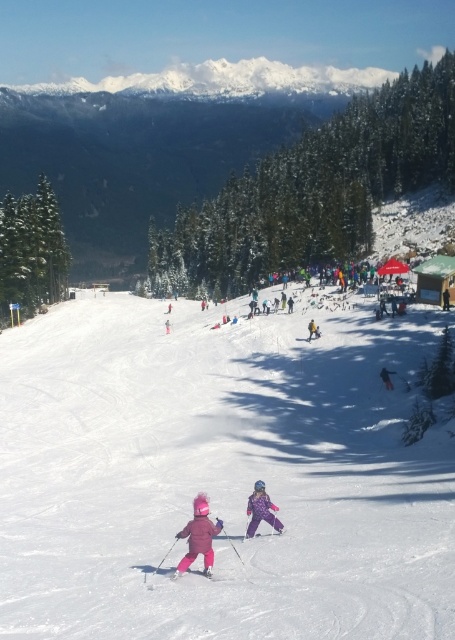
Question: Is the position of yellow fabric jacket at center less distant than that of matte pink ski at center?

Choices:
 (A) yes
 (B) no

Answer: (A)

Question: Estimate the real-world distances between objects in this image. Which object is farther from the matte pink ski suit at lower left?

Choices:
 (A) dark blue snowsuit at center
 (B) pink matte ski at lower center
 (C) yellow fabric jacket at center
 (D) purple matte ski at center

Answer: (C)

Question: Which object appears closest to the camera in this image?

Choices:
 (A) dark blue snowsuit at center
 (B) yellow fabric jacket at center

Answer: (A)

Question: Can you confirm if yellow fabric jacket at center is positioned to the right of purple matte ski at center?

Choices:
 (A) no
 (B) yes

Answer: (B)

Question: Which object appears farthest from the camera in this image?

Choices:
 (A) matte pink ski suit at lower left
 (B) pink matte ski at lower center
 (C) white snow ski slope at center

Answer: (B)

Question: Does dark blue snowsuit at center come in front of yellow fabric jacket at center?

Choices:
 (A) yes
 (B) no

Answer: (A)